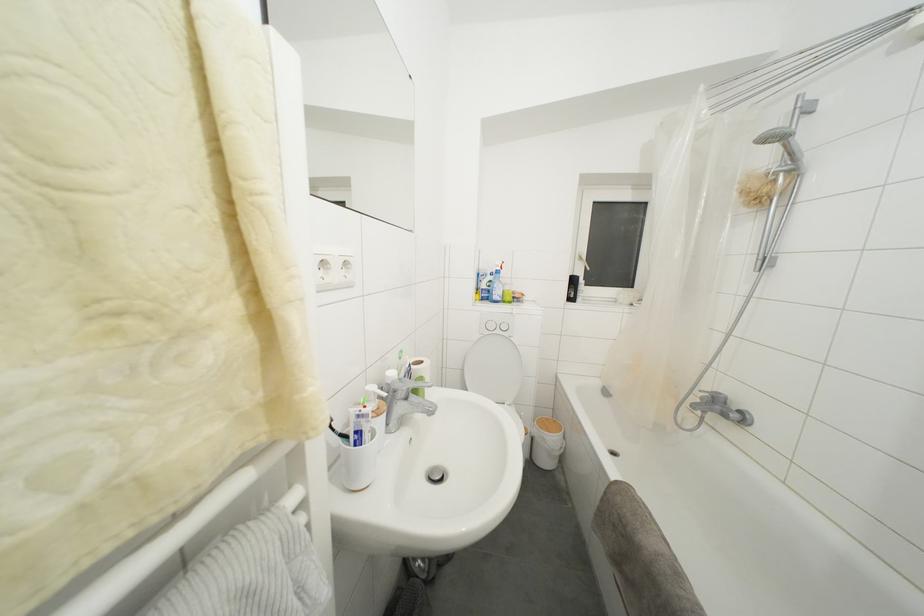
Which object does [359,426] point to?

This point indicates the toothpaste tube.